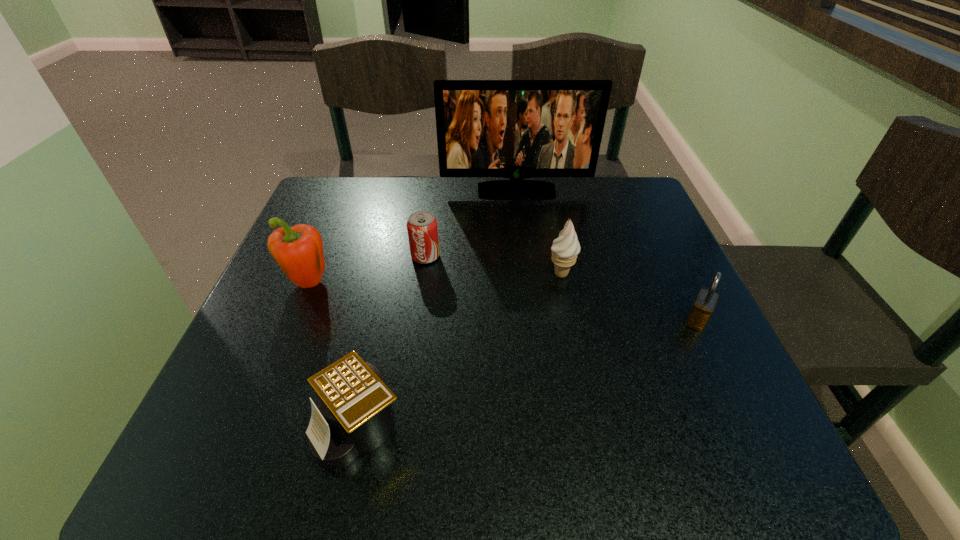
Where is `blank space located 0.170m on the front-facing side of the fourth shortest object`? This screenshot has width=960, height=540. blank space located 0.170m on the front-facing side of the fourth shortest object is located at coordinates (468, 274).

Where is `vacant space situated 0.080m on the front-facing side of the fourth shortest object`? vacant space situated 0.080m on the front-facing side of the fourth shortest object is located at coordinates (511, 274).

Locate an element on the screen. free space located on the front-facing side of the fourth shortest object is located at coordinates (372, 274).

Locate an element on the screen. free space located on the front of the second nearest object is located at coordinates (769, 470).

Find the location of a particular element. vacant area located 0.280m on the left of the soda can is located at coordinates (287, 256).

The image size is (960, 540). I want to click on vacant space located 0.380m on the right of the calculator, so click(x=649, y=427).

Where is `object present at the far edge`? object present at the far edge is located at coordinates (517, 129).

Find the location of a particular element. object present at the near edge is located at coordinates (353, 416).

This screenshot has height=540, width=960. What are the coordinates of `object present at the left edge` in the screenshot? It's located at (298, 250).

Locate an element on the screen. monitor that is at the right edge is located at coordinates (517, 129).